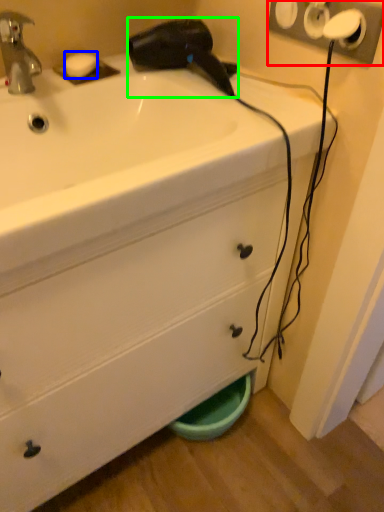
Question: Considering the real-world distances, which object is farthest from electric outlet (highlighted by a red box)? soap (highlighted by a blue box) or hair drier (highlighted by a green box)?

Choices:
 (A) soap
 (B) hair drier

Answer: (A)